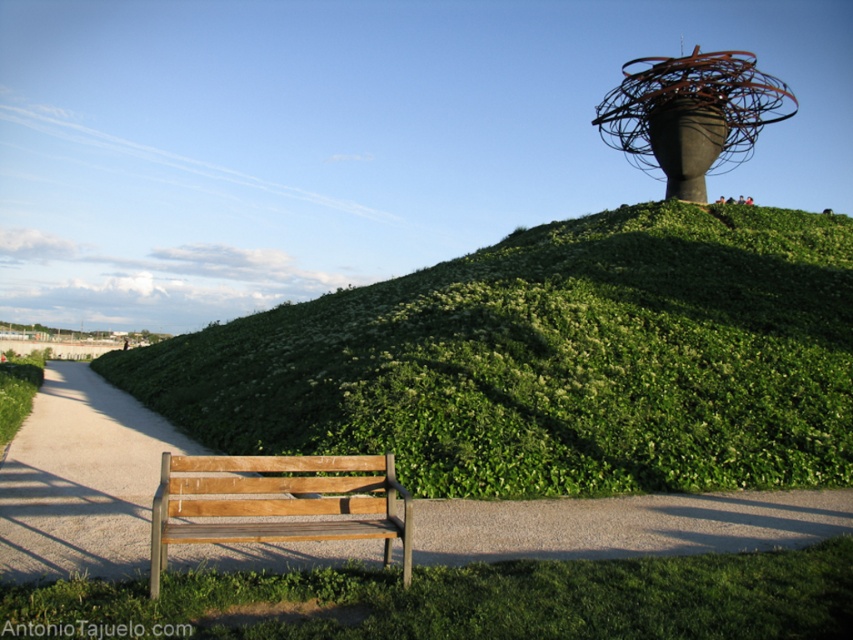
Does green grassy hillside at upper center appear under wooden park bench at lower left?

No.

Between green grassy hillside at upper center and wooden park bench at lower left, which one appears on the right side from the viewer's perspective?

wooden park bench at lower left

Does point (480, 349) come behind point (271, 528)?

That is True.

Find the location of a particular element. green grassy hillside at upper center is located at coordinates (550, 360).

This screenshot has height=640, width=853. What do you see at coordinates (463, 600) in the screenshot? I see `green grass at lower center` at bounding box center [463, 600].

Does green grass at lower center appear on the left side of wooden park bench at lower left?

Correct, you'll find green grass at lower center to the left of wooden park bench at lower left.

Is point (404, 595) in front of point (361, 477)?

That is True.

Where is `green grass at lower center`? This screenshot has width=853, height=640. green grass at lower center is located at coordinates (463, 600).

Does green grassy hillside at upper center have a smaller size compared to green grass at lower center?

Incorrect, green grassy hillside at upper center is not smaller in size than green grass at lower center.

How far apart are green grassy hillside at upper center and green grass at lower center?

15.76 meters

Is point (561, 292) in front of point (663, 598)?

No.

Identify the location of green grassy hillside at upper center. click(x=550, y=360).